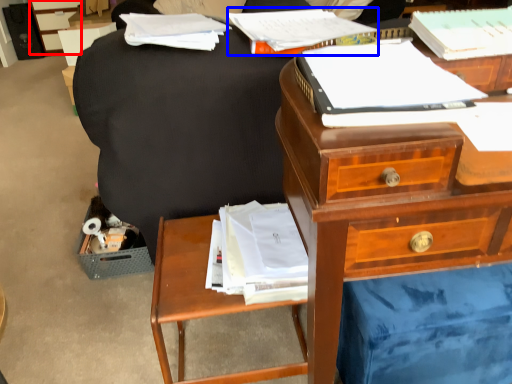
Question: Which point is further to the camera, file cabinet (highlighted by a red box) or paperback book (highlighted by a blue box)?

Choices:
 (A) file cabinet
 (B) paperback book

Answer: (A)